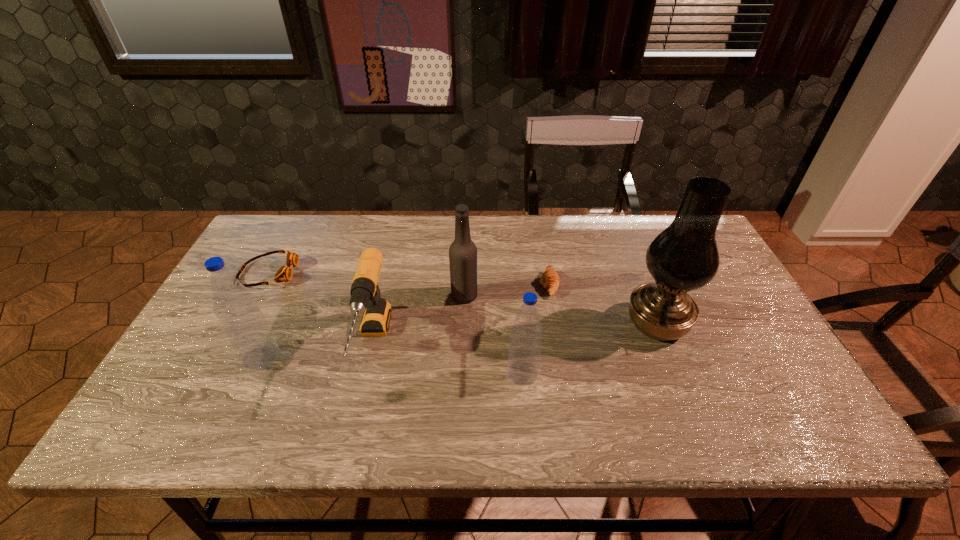
Image resolution: width=960 pixels, height=540 pixels. Identify the location of water bottle that is at the left edge. (245, 326).

Locate an element on the screen. goggles at the left edge is located at coordinates (284, 273).

Locate an element on the screen. This screenshot has height=540, width=960. object located at the far left corner is located at coordinates (284, 273).

Where is `object that is at the near left corner`? Image resolution: width=960 pixels, height=540 pixels. object that is at the near left corner is located at coordinates (245, 326).

In the image, there is a desktop. Where is `vacant space at the far edge`? vacant space at the far edge is located at coordinates (409, 221).

The height and width of the screenshot is (540, 960). What are the coordinates of `vacant space at the near edge of the desktop` in the screenshot? It's located at (x=636, y=380).

This screenshot has height=540, width=960. I want to click on blank space at the far left corner, so click(x=270, y=232).

Identify the location of free space at the near right corner of the desktop. Image resolution: width=960 pixels, height=540 pixels. (749, 384).

You are a GUI agent. You are given a task and a screenshot of the screen. Output one action in this format:
    pyautogui.click(x=<x>, y=<y>)
    Task: Click on the free space between the left water bottle and the goggles
    The image size is (960, 540).
    Given the screenshot: What is the action you would take?
    pyautogui.click(x=265, y=315)

You are a GUI agent. You are given a task and a screenshot of the screen. Output one action in this format:
    pyautogui.click(x=<x>, y=<y>)
    Task: Click on the vacant space in between the shorter water bottle and the fifth object from right to left
    The height and width of the screenshot is (540, 960).
    Given the screenshot: What is the action you would take?
    pyautogui.click(x=447, y=359)